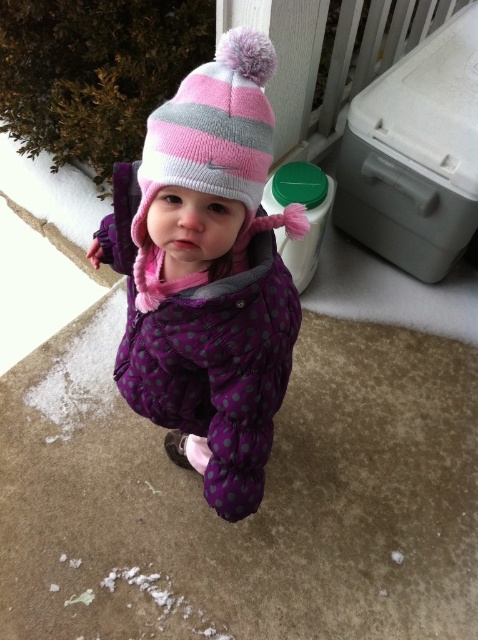
Is purple quilted jacket at center positioned behind pink striped knit hat at upper center?

That is True.

Between point (210, 486) and point (186, 166), which one is positioned behind?

The point (210, 486) is more distant.

Between point (225, 417) and point (246, 156), which one is positioned behind?

Point (225, 417)

Where is `purple quilted jacket at center`? The width and height of the screenshot is (478, 640). purple quilted jacket at center is located at coordinates (208, 356).

Is white plastic cooler at upper right to the left of pink striped knit hat at upper center from the viewer's perspective?

Incorrect, white plastic cooler at upper right is not on the left side of pink striped knit hat at upper center.

Can you confirm if white plastic cooler at upper right is smaller than pink striped knit hat at upper center?

Incorrect, white plastic cooler at upper right is not smaller in size than pink striped knit hat at upper center.

Is point (360, 116) less distant than point (264, 173)?

No, (360, 116) is further to viewer.

What are the coordinates of `white plastic cooler at upper right` in the screenshot? It's located at (415, 154).

Is purple quilted jacket at center behind white plastic cooler at upper right?

No, it is in front of white plastic cooler at upper right.

Does purple quilted jacket at center come in front of white plastic cooler at upper right?

That is True.

Between point (257, 481) and point (366, 180), which one is positioned behind?

Point (366, 180)

In order to click on purple quilted jacket at center in this screenshot , I will do `click(208, 356)`.